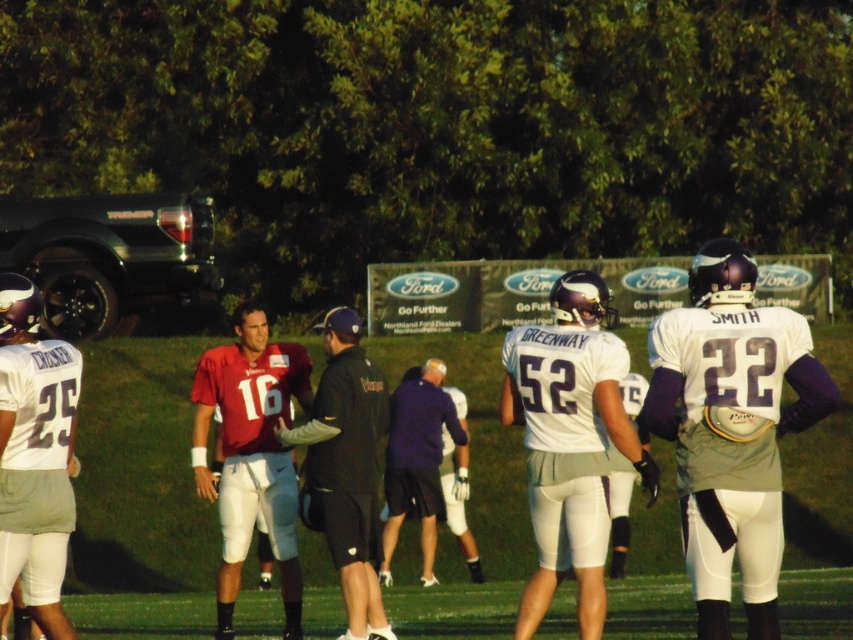
Who is shorter, white matte jersey at right or matte red jersey at center?

white matte jersey at right

Looking at this image, is white matte jersey at right taller than matte red jersey at center?

No, white matte jersey at right is not taller than matte red jersey at center.

What do you see at coordinates (730, 428) in the screenshot?
I see `white matte jersey at right` at bounding box center [730, 428].

Locate an element on the screen. This screenshot has height=640, width=853. white matte jersey at right is located at coordinates (730, 428).

Can you confirm if white matte jersey at right is taller than white matte uniform at center?

Incorrect, white matte jersey at right's height is not larger of white matte uniform at center's.

Is white matte jersey at right to the right of white matte uniform at center from the viewer's perspective?

Result: Correct, you'll find white matte jersey at right to the right of white matte uniform at center.

Image resolution: width=853 pixels, height=640 pixels. Identify the location of white matte jersey at right. (730, 428).

Image resolution: width=853 pixels, height=640 pixels. Find the location of `white matte jersey at right`. white matte jersey at right is located at coordinates (730, 428).

Does white matte jersey at center have a lesser width compared to dark blue uniform at center?

No.

Who is more distant from viewer, (787, 339) or (335, 481)?

Point (335, 481)

Where is `white matte jersey at center`? The height and width of the screenshot is (640, 853). white matte jersey at center is located at coordinates (740, 449).

I want to click on white matte jersey at center, so coord(740,449).